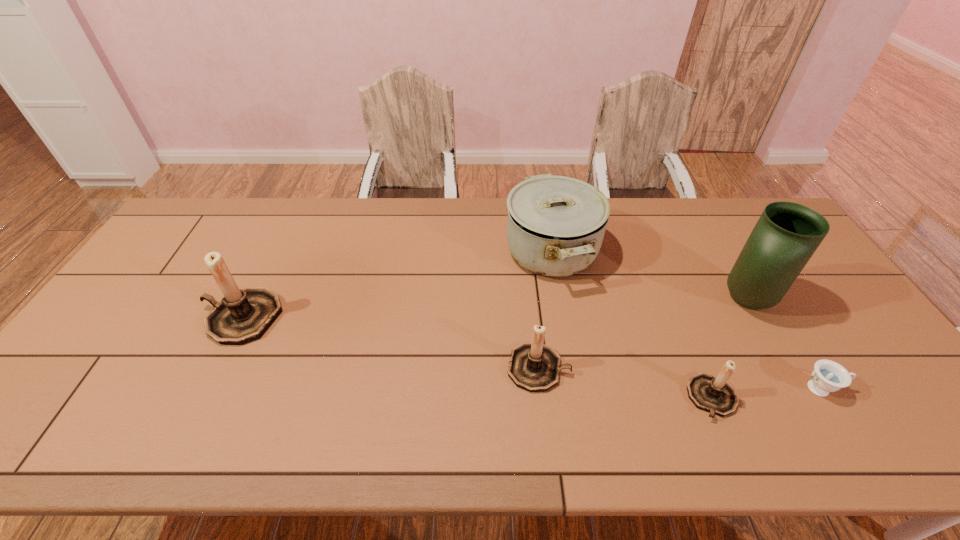
Find the location of a particular element. The height and width of the screenshot is (540, 960). vacant position at the left edge of the desktop is located at coordinates (136, 286).

This screenshot has width=960, height=540. I want to click on vacant space at the right edge, so click(824, 355).

Find the location of `vacant space at the far left corner of the desktop`. vacant space at the far left corner of the desktop is located at coordinates (183, 234).

At what (x,y) coordinates should I click in order to perform the action: click on empty space between the saucepan and the teacup. Please return your answer as a coordinate pair (x, y). This screenshot has width=960, height=540. Looking at the image, I should click on (686, 320).

The image size is (960, 540). I want to click on vacant area between the vase and the second shortest candle holder, so click(x=642, y=334).

Where is `empty space that is in between the leftmost object and the second shortest object`? empty space that is in between the leftmost object and the second shortest object is located at coordinates (476, 357).

Identify the location of free space between the saucepan and the vase. The width and height of the screenshot is (960, 540). (649, 276).

What are the coordinates of `free spot between the second shortest candle holder and the fifth shortest object` in the screenshot? It's located at (390, 343).

The height and width of the screenshot is (540, 960). I want to click on vacant space in between the tallest object and the second shortest candle holder, so click(x=642, y=334).

Identify the location of free spot between the second candle holder from right to left and the saucepan. The height and width of the screenshot is (540, 960). (544, 310).